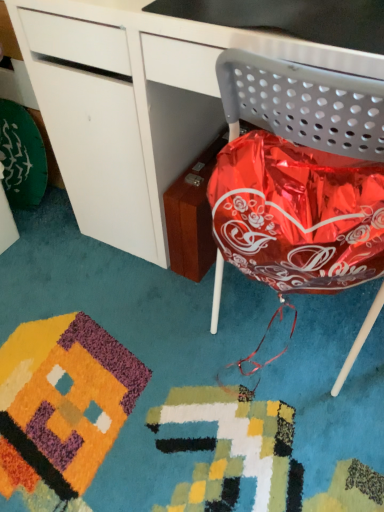
The image size is (384, 512). What do you see at coordinates (159, 91) in the screenshot? I see `glossy white desk at center` at bounding box center [159, 91].

Find the location of a particular element. The width and height of the screenshot is (384, 512). glossy white desk at center is located at coordinates (159, 91).

What is the approximate width of glossy white desk at center?

It is 27.64 inches.

Describe the element at coordinates (278, 77) in the screenshot. The width and height of the screenshot is (384, 512). I see `metallic gray chair at right` at that location.

This screenshot has width=384, height=512. Identify the location of metallic gray chair at right. (278, 77).

What is the approximate width of metallic gray chair at right?

metallic gray chair at right is 18.78 inches wide.

You are a GUI agent. You are given a task and a screenshot of the screen. Output one action in this format:
    pyautogui.click(x=<x>, y=<y>)
    Task: Click on the glossy white desk at center
    
    Given the screenshot: What is the action you would take?
    pyautogui.click(x=159, y=91)

Which is more to the left, metallic gray chair at right or glossy white desk at center?

glossy white desk at center is more to the left.

Which is in front, metallic gray chair at right or glossy white desk at center?

metallic gray chair at right is more forward.

Which is farther, (281, 89) or (123, 74)?

Positioned behind is point (123, 74).

From the image's perspective, between metallic gray chair at right and glossy white desk at center, which one is located above?

From the image's view, glossy white desk at center is above.

From a real-world perspective, which object stands above the other?

metallic gray chair at right, from a real-world perspective.

Considering the relative sizes of metallic gray chair at right and glossy white desk at center in the image provided, is metallic gray chair at right wider than glossy white desk at center?

No, metallic gray chair at right is not wider than glossy white desk at center.

Considering the relative sizes of metallic gray chair at right and glossy white desk at center in the image provided, is metallic gray chair at right shorter than glossy white desk at center?

Yes.

In terms of size, does metallic gray chair at right appear bigger or smaller than glossy white desk at center?

Considering their sizes, metallic gray chair at right takes up less space than glossy white desk at center.

Is metallic gray chair at right surrounding glossy white desk at center?

No, glossy white desk at center is not surrounded by metallic gray chair at right.

Is there a large distance between metallic gray chair at right and glossy white desk at center?

No, there isn't a large distance between metallic gray chair at right and glossy white desk at center.

Is metallic gray chair at right aimed at glossy white desk at center?

Yes, metallic gray chair at right faces towards glossy white desk at center.

How many degrees apart are the facing directions of metallic gray chair at right and glossy white desk at center?

metallic gray chair at right and glossy white desk at center are facing 180 degrees away from each other.

Identify the location of chair on the right of glossy white desk at center. (278, 77).

Considering the relative positions of glossy white desk at center and metallic gray chair at right in the image provided, is glossy white desk at center to the right of metallic gray chair at right from the viewer's perspective?

In fact, glossy white desk at center is to the left of metallic gray chair at right.

Considering the positions of objects glossy white desk at center and metallic gray chair at right in the image provided, who is in front, glossy white desk at center or metallic gray chair at right?

Positioned in front is metallic gray chair at right.

Does point (29, 54) appear closer or farther from the camera than point (253, 65)?

Point (29, 54).

From the image's perspective, is glossy white desk at center under metallic gray chair at right?

Actually, glossy white desk at center appears above metallic gray chair at right in the image.

From a real-world perspective, between glossy white desk at center and metallic gray chair at right, who is vertically lower?

In real-world perspective, glossy white desk at center is lower.

Can you confirm if glossy white desk at center is wider than metallic gray chair at right?

Indeed, glossy white desk at center has a greater width compared to metallic gray chair at right.

In terms of height, does glossy white desk at center look taller or shorter compared to metallic gray chair at right?

glossy white desk at center is taller than metallic gray chair at right.

Considering the sizes of glossy white desk at center and metallic gray chair at right in the image, is glossy white desk at center bigger or smaller than metallic gray chair at right?

Considering their sizes, glossy white desk at center takes up more space than metallic gray chair at right.

Could metallic gray chair at right be considered to be inside glossy white desk at center?

Absolutely, metallic gray chair at right is inside glossy white desk at center.

Is glossy white desk at center in contact with metallic gray chair at right?

There is a gap between glossy white desk at center and metallic gray chair at right.

Does glossy white desk at center turn towards metallic gray chair at right?

Yes, glossy white desk at center is aimed at metallic gray chair at right.

Can you tell me how much glossy white desk at center and metallic gray chair at right differ in facing direction?

There is a 180-degree angle between the facing directions of glossy white desk at center and metallic gray chair at right.

The image size is (384, 512). In order to click on desk lying above the metallic gray chair at right (from the image's perspective) in this screenshot , I will do `click(159, 91)`.

Locate an element on the screen. The height and width of the screenshot is (512, 384). desk on the left side of metallic gray chair at right is located at coordinates (159, 91).

Locate an element on the screen. The width and height of the screenshot is (384, 512). desk behind the metallic gray chair at right is located at coordinates (159, 91).